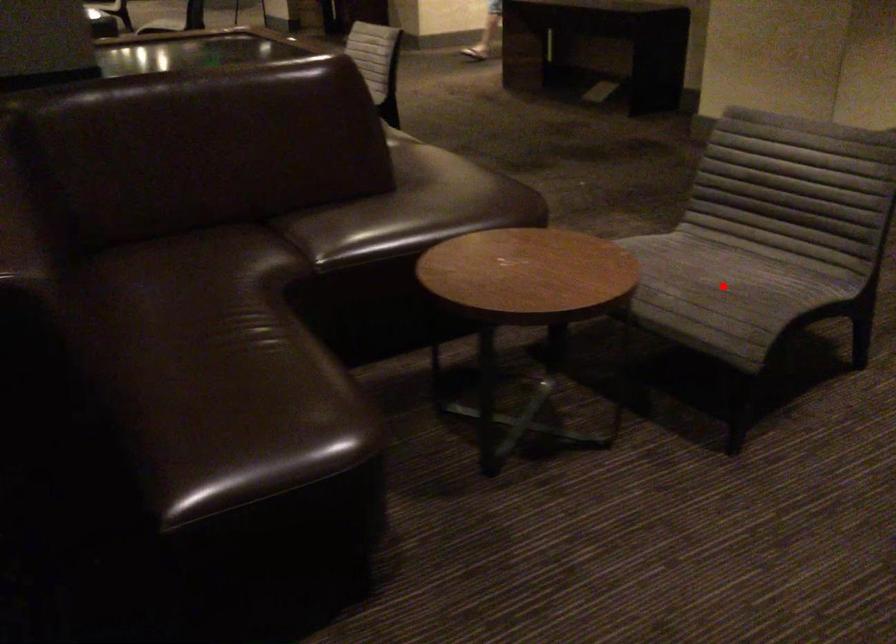
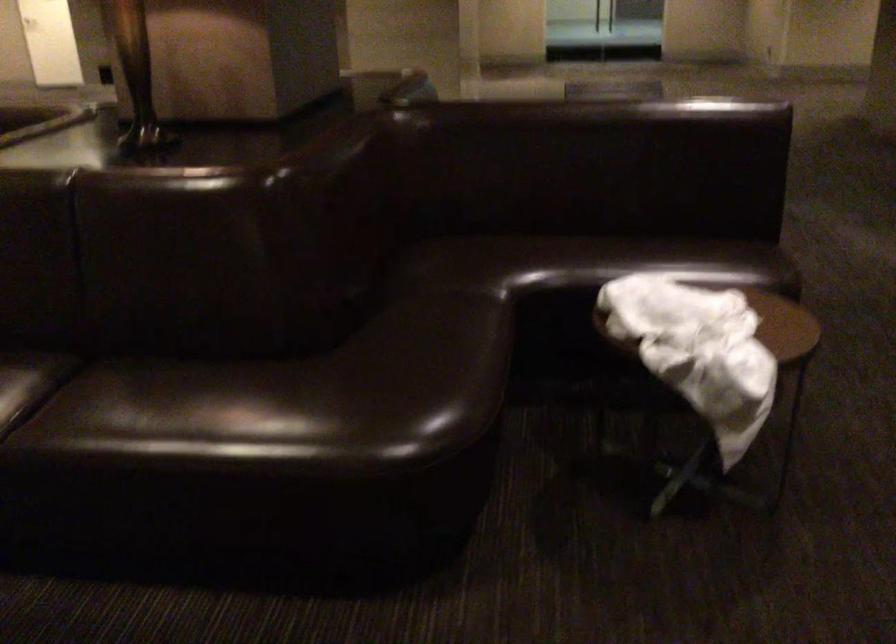
Question: I am providing you with two images of the same scene from different viewpoints. A red point is marked on the first image. Can you still see the location of the red point in image 2?

Choices:
 (A) Yes
 (B) No

Answer: (B)